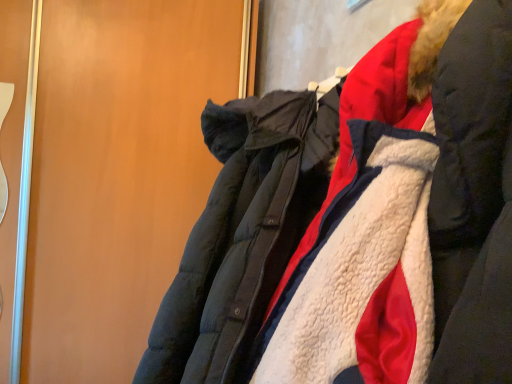
In order to face matte black coat at right, should I rotate leftwards or rightwards?

Rotate left and turn 16.510 degrees.

Describe the element at coordinates (117, 173) in the screenshot. Image resolution: width=512 pixels, height=384 pixels. I see `matte black coat at right` at that location.

What are the coordinates of `matte black coat at right` in the screenshot? It's located at (117, 173).

Describe the element at coordinates (358, 224) in the screenshot. Image resolution: width=512 pixels, height=384 pixels. I see `white fleece jacket at center` at that location.

Where is `white fleece jacket at center`? white fleece jacket at center is located at coordinates (358, 224).

The height and width of the screenshot is (384, 512). I want to click on matte black coat at right, so click(x=117, y=173).

Which is more to the left, matte black coat at right or white fleece jacket at center?

matte black coat at right.

Is matte black coat at right behind white fleece jacket at center?

Yes.

Does point (57, 232) appear closer or farther from the camera than point (275, 288)?

Clearly, point (57, 232) is more distant from the camera than point (275, 288).

From the image's perspective, between matte black coat at right and white fleece jacket at center, which one is located above?

matte black coat at right appears higher in the image.

From a real-world perspective, is matte black coat at right physically located above or below white fleece jacket at center?

From a real-world perspective, matte black coat at right is physically above white fleece jacket at center.

Is matte black coat at right wider than white fleece jacket at center?

Incorrect, the width of matte black coat at right does not surpass that of white fleece jacket at center.

Can you confirm if matte black coat at right is shorter than white fleece jacket at center?

Incorrect, the height of matte black coat at right does not fall short of that of white fleece jacket at center.

Is matte black coat at right bigger or smaller than white fleece jacket at center?

In the image, matte black coat at right appears to be larger than white fleece jacket at center.

Choose the correct answer: Is matte black coat at right inside white fleece jacket at center or outside it?

matte black coat at right is spatially situated outside white fleece jacket at center.

Is matte black coat at right beside white fleece jacket at center?

No, matte black coat at right is not next to white fleece jacket at center.

Is matte black coat at right aimed at white fleece jacket at center?

Yes, matte black coat at right faces towards white fleece jacket at center.

How much distance is there between matte black coat at right and white fleece jacket at center?

37.39 inches.

The width and height of the screenshot is (512, 384). I want to click on door on the left of white fleece jacket at center, so click(117, 173).

Between white fleece jacket at center and matte black coat at right, which one appears on the left side from the viewer's perspective?

From the viewer's perspective, matte black coat at right appears more on the left side.

Considering their positions, is white fleece jacket at center located in front of or behind matte black coat at right?

white fleece jacket at center is positioned closer to the viewer than matte black coat at right.

Does point (354, 351) come closer to viewer compared to point (73, 228)?

Yes, point (354, 351) is closer to viewer.

From the image's perspective, which is above, white fleece jacket at center or matte black coat at right?

From the image's view, matte black coat at right is above.

From a real-world perspective, is white fleece jacket at center physically located above or below matte black coat at right?

Clearly, from a real-world perspective, white fleece jacket at center is below matte black coat at right.

Does white fleece jacket at center have a greater width compared to matte black coat at right?

Yes.

From their relative heights in the image, would you say white fleece jacket at center is taller or shorter than matte black coat at right?

Considering their sizes, white fleece jacket at center has less height than matte black coat at right.

In terms of size, does white fleece jacket at center appear bigger or smaller than matte black coat at right?

Clearly, white fleece jacket at center is smaller in size than matte black coat at right.

Would you say white fleece jacket at center is inside or outside matte black coat at right?

white fleece jacket at center is spatially situated outside matte black coat at right.

Are white fleece jacket at center and matte black coat at right beside each other?

No, white fleece jacket at center is not making contact with matte black coat at right.

Looking at this image, is white fleece jacket at center oriented away from matte black coat at right?

No.

At what (x,y) coordinates should I click in order to perform the action: click on door that is behind the white fleece jacket at center. Please return your answer as a coordinate pair (x, y). The image size is (512, 384). Looking at the image, I should click on (117, 173).

Image resolution: width=512 pixels, height=384 pixels. I want to click on jacket below the matte black coat at right (from a real-world perspective), so click(x=358, y=224).

The width and height of the screenshot is (512, 384). Find the location of `jacket that appears below the matte black coat at right (from the image's perspective)`. jacket that appears below the matte black coat at right (from the image's perspective) is located at coordinates (358, 224).